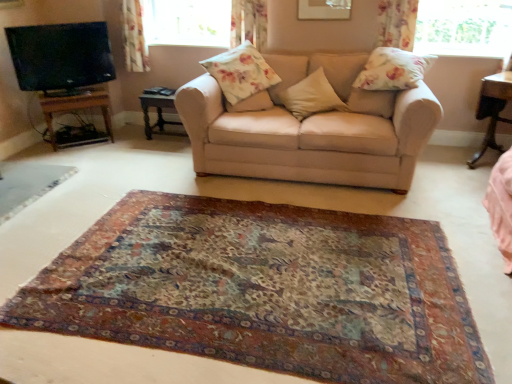
Question: Would you say floral fabric pillow at upper right, the 4th pillow positioned from the left, is to the left or to the right of floral fabric curtain at upper left, placed as the third curtain when sorted from right to left, in the picture?

Choices:
 (A) left
 (B) right

Answer: (B)

Question: From the image's perspective, is floral fabric pillow at upper right, the 4th pillow positioned from the left, located above or below floral fabric curtain at upper left, the 1th curtain in the left-to-right sequence?

Choices:
 (A) above
 (B) below

Answer: (B)

Question: Based on their relative distances, which object is nearer to the carpeted mat at center?

Choices:
 (A) flat screen tv at left
 (B) floral fabric pillow at center, which is counted as the fourth pillow, starting from the right
 (C) beige fabric couch at center
 (D) wooden table at left, the 1th table positioned from the left
 (E) floral fabric curtain at upper right, the third curtain from the left

Answer: (C)

Question: Estimate the real-world distances between objects in this image. Which object is farther from the beige fabric couch at center?

Choices:
 (A) wooden table at left, acting as the 2th table starting from the left
 (B) wooden table at right, the third table when ordered from left to right
 (C) flat screen tv at left
 (D) floral fabric pillow at center, which is counted as the 1th pillow, starting from the left
 (E) transparent glass window at upper right, which is the 1th window in right-to-left order

Answer: (C)